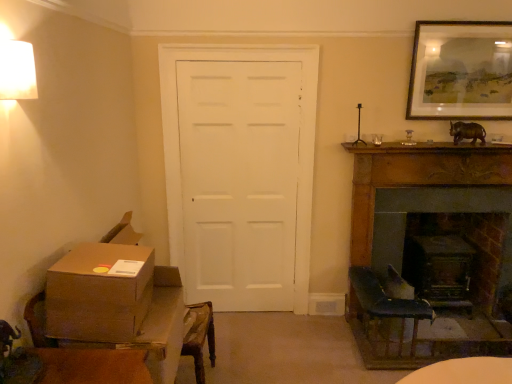
Where is `free space above white matte door at center (from a real-world perspective)`? The image size is (512, 384). free space above white matte door at center (from a real-world perspective) is located at coordinates (238, 45).